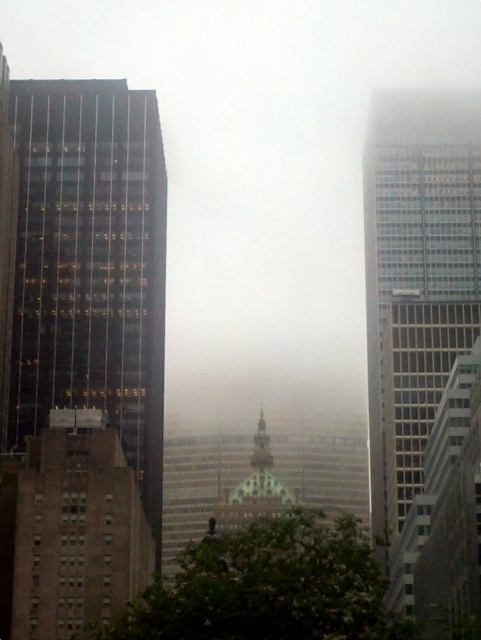
Can you confirm if dark glass skyscraper at left is bigger than glassy reflective skyscraper at right?

No, dark glass skyscraper at left is not bigger than glassy reflective skyscraper at right.

Who is taller, dark glass skyscraper at left or glassy reflective skyscraper at right?

With more height is glassy reflective skyscraper at right.

Is point (11, 372) closer to camera compared to point (396, 268)?

That is True.

This screenshot has height=640, width=481. I want to click on dark glass skyscraper at left, so click(x=90, y=266).

How distant is glassy reflective skyscraper at right from brown brick building at lower left?

glassy reflective skyscraper at right is 52.36 meters away from brown brick building at lower left.

In the scene shown: Which is more to the left, glassy reflective skyscraper at right or brown brick building at lower left?

brown brick building at lower left

Who is more forward, (392,144) or (60,589)?

Positioned in front is point (60,589).

The image size is (481, 640). Find the location of `glassy reflective skyscraper at right`. glassy reflective skyscraper at right is located at coordinates (416, 280).

Does dark glass skyscraper at left have a greater width compared to brown brick building at lower left?

Indeed, dark glass skyscraper at left has a greater width compared to brown brick building at lower left.

Is point (75, 196) less distant than point (65, 422)?

No, it is not.

The width and height of the screenshot is (481, 640). Find the location of `dark glass skyscraper at left`. dark glass skyscraper at left is located at coordinates (90, 266).